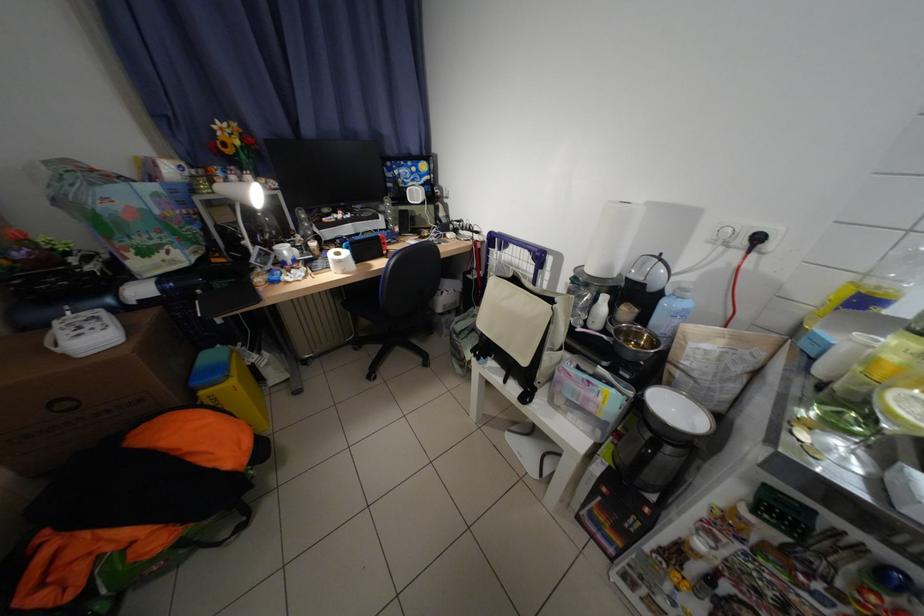
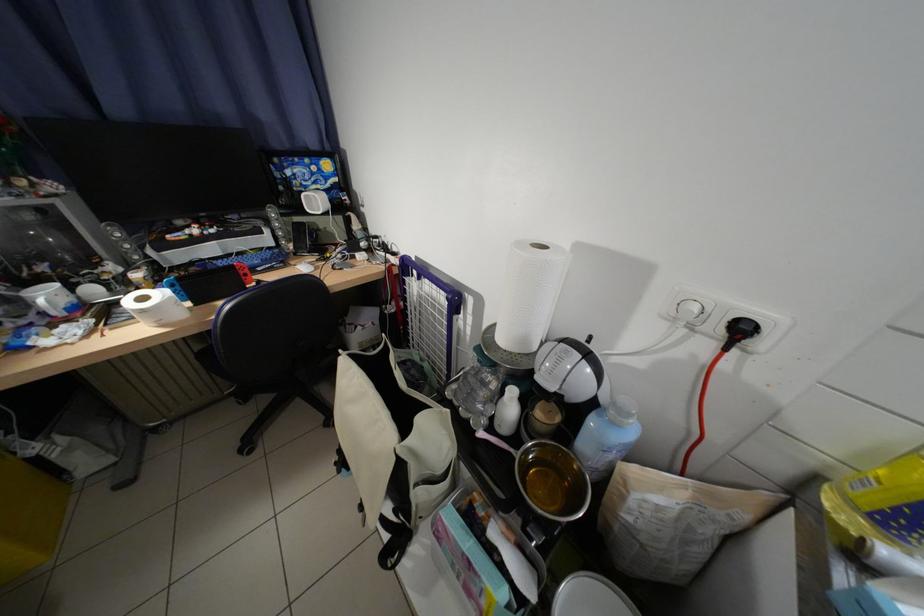
Where in the second image is the point corresponding to (606,301) from the first image?

(514, 392)